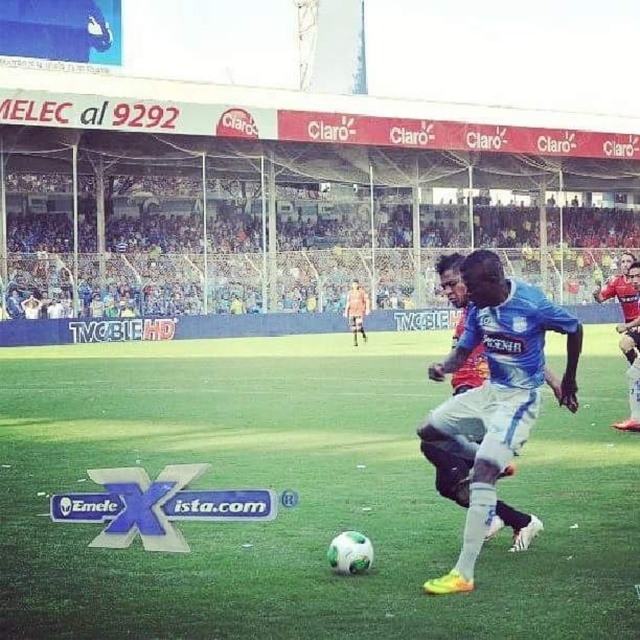
You are a photographer at the soccer match. You want to take a photo where both the blue jersey at center and the light brown leather jacket at center are visible. Considering their heights, which one might you need to adjust your camera angle to see better?

The blue jersey at center has a lesser height compared to light brown leather jacket at center, so you might need to lower your camera angle to ensure the blue jersey at center is fully visible while still capturing the taller light brown leather jacket at center.

You are a soccer player who needs to pass the ball to your teammate wearing a light brown leather jacket at center. The ball is currently at the green grass soccer ball at center. Which direction should you pass the ball to reach your teammate?

The green grass soccer ball at center is to the left of the light brown leather jacket at center, so you should pass the ball to the right to reach your teammate.

You are a soccer player positioned at the edge of the field watching the action. You notice the green grass soccer ball at center and the blue jersey at center. Which object is closer to the left side of the field?

The green grass soccer ball at center is closer to the left side of the field since it is positioned to the left of the blue jersey at center.